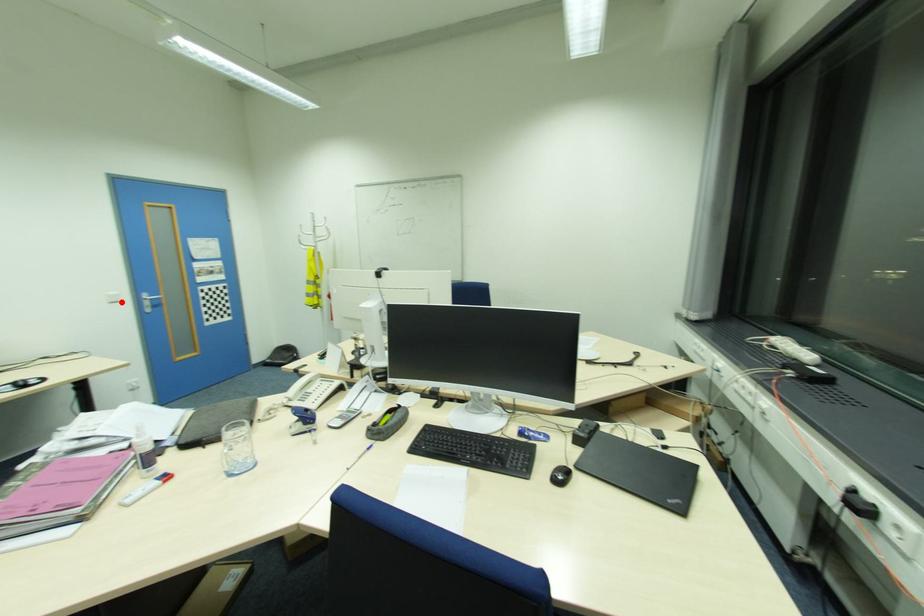
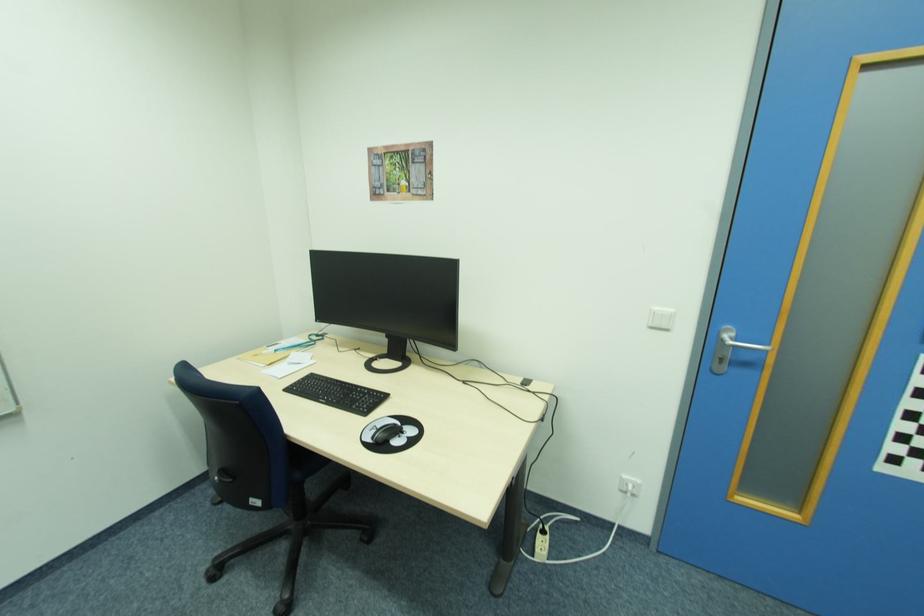
The point at the highlighted location is marked in the first image. Where is the corresponding point in the second image?

(670, 329)